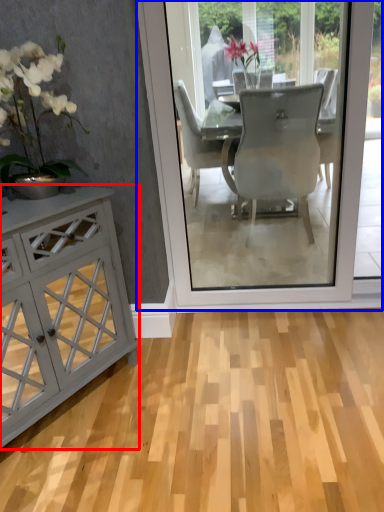
Question: Which point is closer to the camera, cabinetry (highlighted by a red box) or screen door (highlighted by a blue box)?

Choices:
 (A) cabinetry
 (B) screen door

Answer: (A)